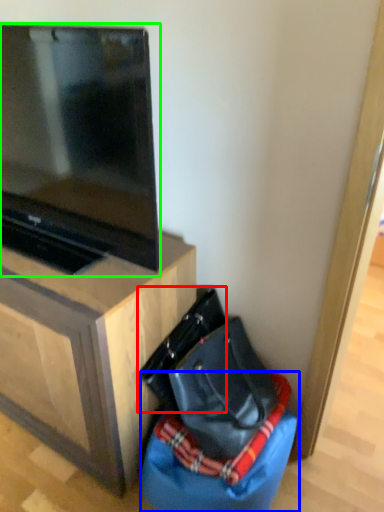
Question: Considering the real-world distances, which object is farthest from messenger bag (highlighted by a red box)? bean bag chair (highlighted by a blue box) or television (highlighted by a green box)?

Choices:
 (A) bean bag chair
 (B) television

Answer: (B)